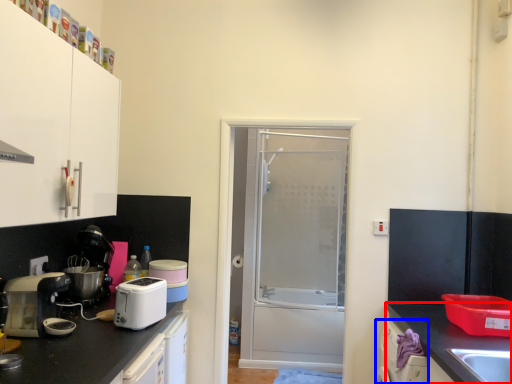
Question: Which of the following is the closest to the observer, countertop (highlighted by a red box) or dish washer (highlighted by a blue box)?

Choices:
 (A) countertop
 (B) dish washer

Answer: (A)